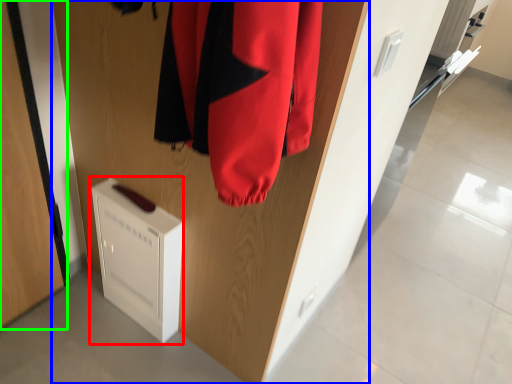
Question: Estimate the real-world distances between objects in this image. Which object is farther from appliance (highlighted by a red box), door (highlighted by a blue box) or door (highlighted by a green box)?

Choices:
 (A) door
 (B) door

Answer: (B)